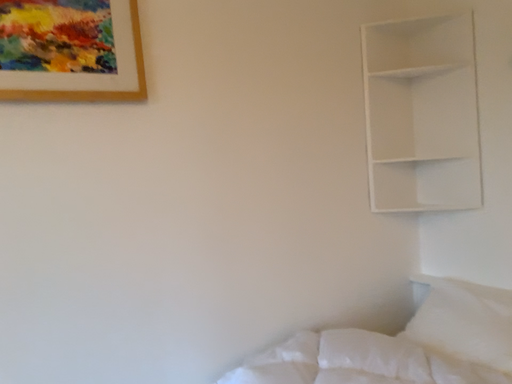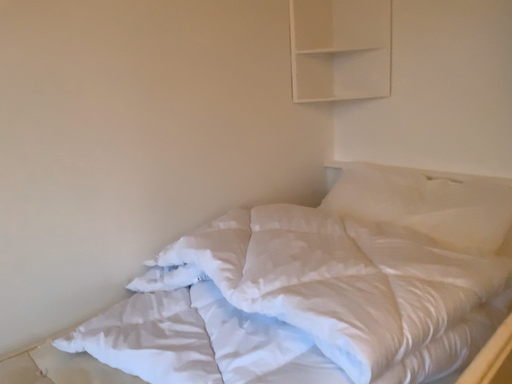
Question: Which way did the camera rotate in the video?

Choices:
 (A) rotated upward
 (B) rotated downward

Answer: (B)